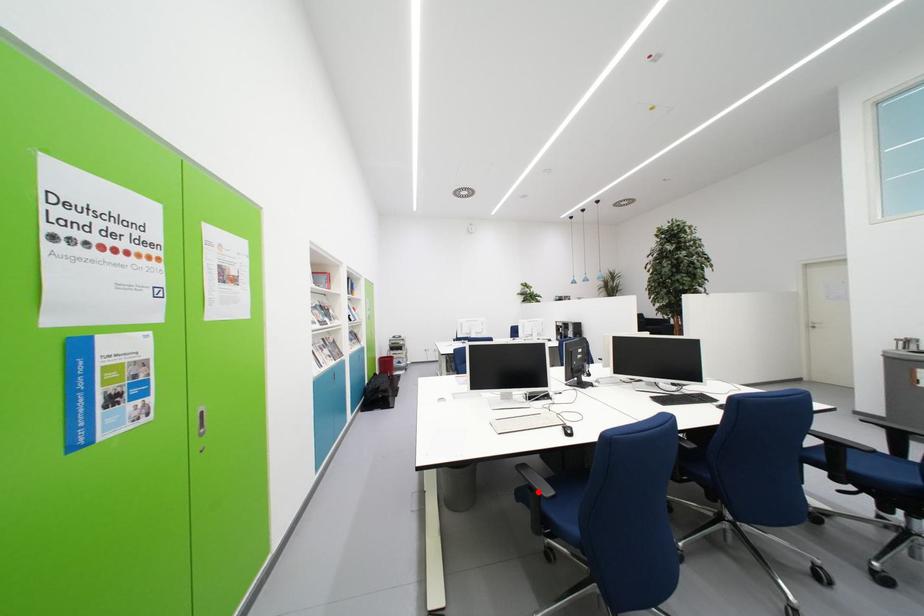
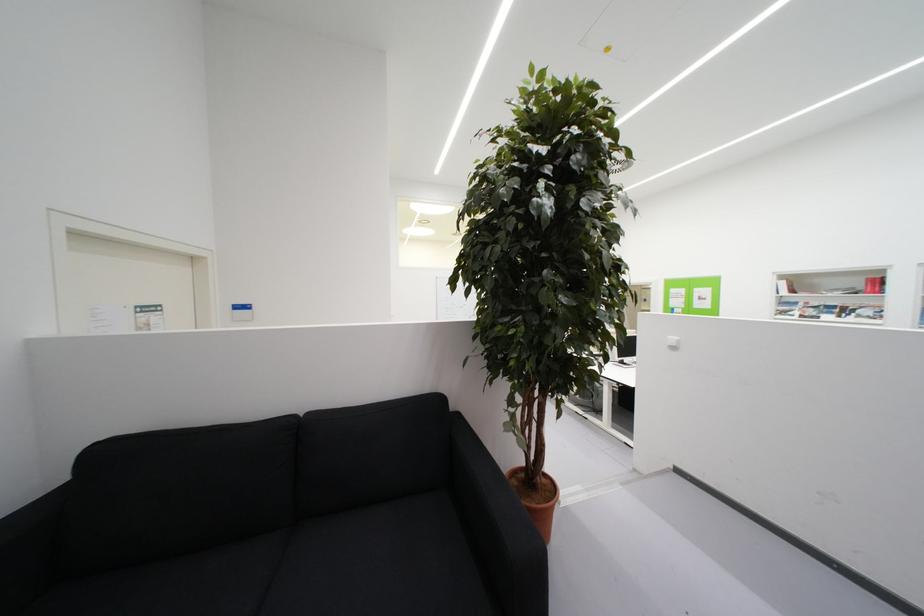
Question: I am providing you with two images of the same scene from different viewpoints. A red point is marked on the first image. At the location where the point appears in image 1, is it still visible in image 2?

Choices:
 (A) Yes
 (B) No

Answer: (B)